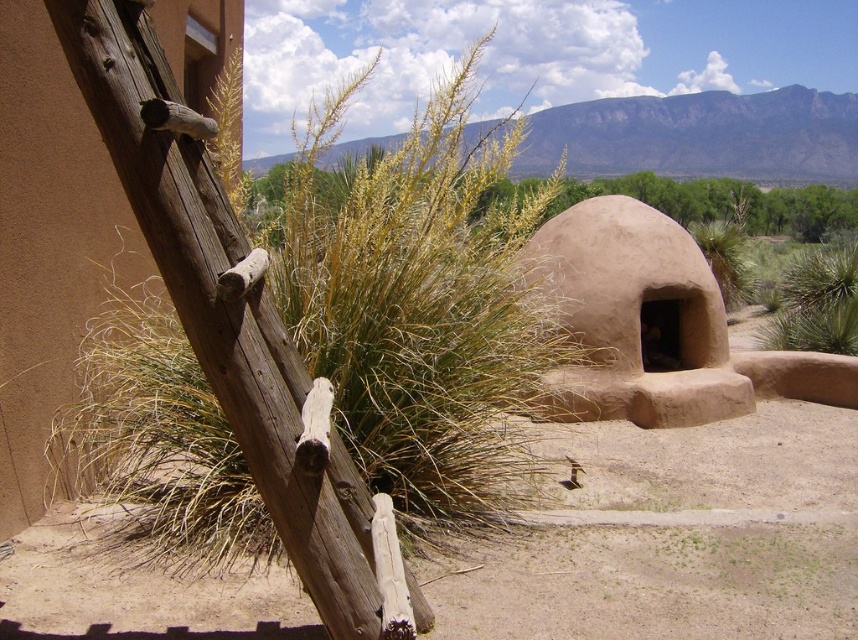
Between point (355, 396) and point (811, 214), which one is positioned behind?

The point (811, 214) is more distant.

Is point (457, 480) farther from camera compared to point (650, 176)?

That is False.

Find the location of a particular element. Image resolution: width=858 pixels, height=640 pixels. dry grass at left is located at coordinates (421, 310).